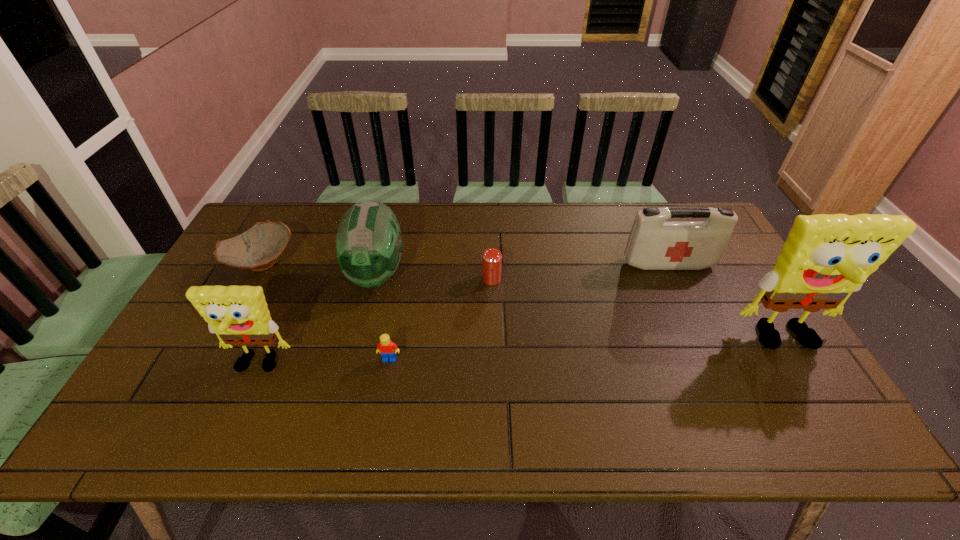
Find the location of a particular element. This screenshot has width=960, height=540. free spot located on the right of the pottery is located at coordinates (372, 262).

You are a GUI agent. You are given a task and a screenshot of the screen. Output one action in this format:
    pyautogui.click(x=<x>, y=<y>)
    Task: Click on the free space located 0.200m on the front side of the first-aid kit
    
    Given the screenshot: What is the action you would take?
    coord(694,321)

The width and height of the screenshot is (960, 540). Identify the location of vacant space located 0.310m on the visor of the football helmet. (346, 398).

Locate an element on the screen. vacant point located 0.110m on the face of the Lego is located at coordinates (382, 402).

Image resolution: width=960 pixels, height=540 pixels. I want to click on object that is at the far edge, so click(257, 249).

Find the location of a particular element. The height and width of the screenshot is (540, 960). object positioned at the near edge is located at coordinates (239, 315).

In order to click on sponge at the left edge in this screenshot , I will do `click(239, 315)`.

Identify the location of pottery present at the left edge. (257, 249).

The height and width of the screenshot is (540, 960). What are the coordinates of `sponge that is at the right edge` in the screenshot? It's located at (825, 258).

Locate an element on the screen. the first-aid kit positioned at the right edge is located at coordinates (654, 244).